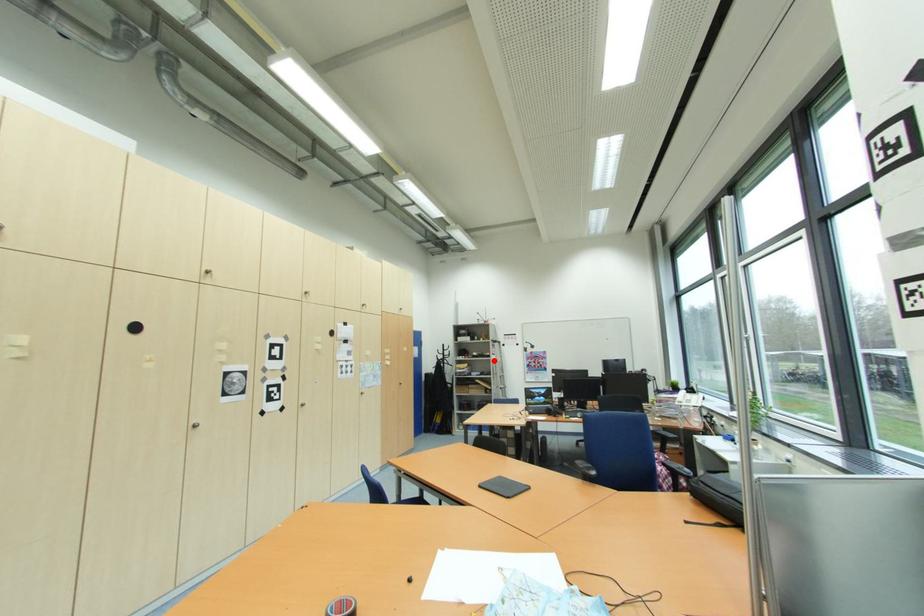
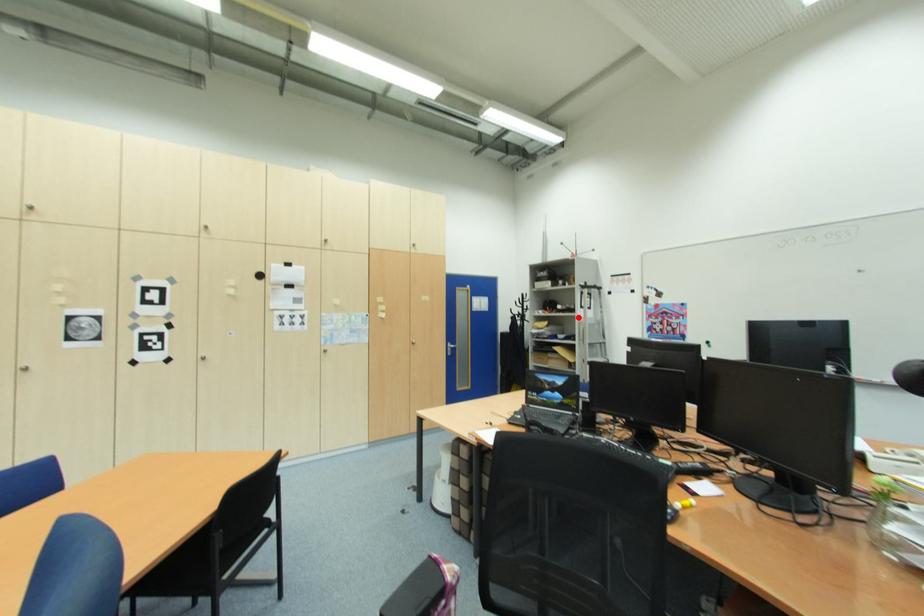
I am providing you with two images of the same scene from different viewpoints. A red point is marked on the first image and another point is marked on the second image. Do the highlighted points in image1 and image2 indicate the same real-world spot?

Yes